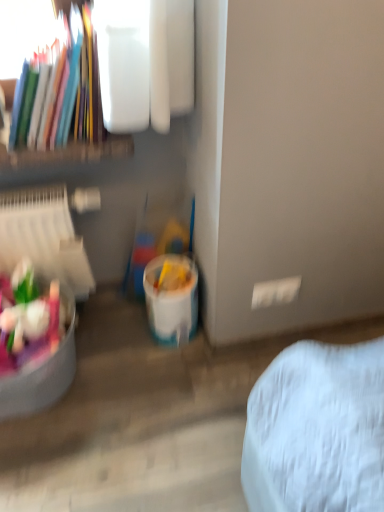
What is the approximate width of white plastic bucket at lower center?

white plastic bucket at lower center is 19.89 centimeters wide.

Image resolution: width=384 pixels, height=512 pixels. I want to click on matte plastic toys at lower left, so click(29, 319).

Does matte plastic books at upper left turn towards matte plastic toys at lower left?

No, matte plastic books at upper left is not aimed at matte plastic toys at lower left.

Which is correct: matte plastic books at upper left is inside matte plastic toys at lower left, or outside of it?

matte plastic books at upper left is outside matte plastic toys at lower left.

How distant is matte plastic books at upper left from matte plastic toys at lower left?

They are 51.07 centimeters apart.

Considering the sizes of matte plastic toys at lower left and white plastic bucket at lower center in the image, is matte plastic toys at lower left wider or thinner than white plastic bucket at lower center?

matte plastic toys at lower left is wider than white plastic bucket at lower center.

Does matte plastic toys at lower left contain white plastic bucket at lower center?

No, white plastic bucket at lower center is not surrounded by matte plastic toys at lower left.

Is matte plastic toys at lower left not close to white plastic bucket at lower center?

matte plastic toys at lower left is actually quite close to white plastic bucket at lower center.

Could you tell me if matte plastic toys at lower left is turned towards white plastic bucket at lower center?

No, matte plastic toys at lower left is not turned towards white plastic bucket at lower center.

Is matte plastic books at upper left facing away from white plastic bucket at lower center?

No, matte plastic books at upper left is not facing the opposite direction of white plastic bucket at lower center.

Considering the sizes of objects matte plastic books at upper left and white plastic bucket at lower center in the image provided, who is thinner, matte plastic books at upper left or white plastic bucket at lower center?

With smaller width is white plastic bucket at lower center.

Which object is closer to the camera taking this photo, matte plastic books at upper left or white plastic bucket at lower center?

matte plastic books at upper left is in front.

Between matte plastic books at upper left and white plastic bucket at lower center, which one has smaller size?

white plastic bucket at lower center is smaller.

Which of these two, white plastic bucket at lower center or matte plastic toys at lower left, is smaller?

white plastic bucket at lower center.

Considering their positions, is white plastic bucket at lower center located in front of or behind matte plastic toys at lower left?

Visually, white plastic bucket at lower center is located behind matte plastic toys at lower left.

Would you say white plastic bucket at lower center is outside matte plastic toys at lower left?

white plastic bucket at lower center is positioned outside matte plastic toys at lower left.

Between white plastic bucket at lower center and matte plastic books at upper left, which one has larger size?

matte plastic books at upper left.

Considering the points (186, 285) and (64, 139), which point is in front, point (186, 285) or point (64, 139)?

The point (64, 139) is in front.

Considering the positions of objects white plastic bucket at lower center and matte plastic books at upper left in the image provided, who is in front, white plastic bucket at lower center or matte plastic books at upper left?

Positioned in front is matte plastic books at upper left.

Where is `book above the white plastic bucket at lower center (from the image's perspective)`? book above the white plastic bucket at lower center (from the image's perspective) is located at coordinates (59, 88).

Which point is more forward, (x=44, y=350) or (x=24, y=122)?

The point (x=24, y=122) is more forward.

Is matte plastic toys at lower left next to matte plastic books at upper left and touching it?

There is a gap between matte plastic toys at lower left and matte plastic books at upper left.

In the image, is matte plastic toys at lower left positioned in front of or behind matte plastic books at upper left?

In the image, matte plastic toys at lower left appears behind matte plastic books at upper left.

You are a GUI agent. You are given a task and a screenshot of the screen. Output one action in this format:
    pyautogui.click(x=<x>, y=<y>)
    Task: Click on the food beneath the matte plastic books at upper left (from a real-world perspective)
    The image size is (384, 512).
    Given the screenshot: What is the action you would take?
    pyautogui.click(x=29, y=319)

Locate an element on the screen. Image resolution: width=384 pixels, height=512 pixels. food in front of the white plastic bucket at lower center is located at coordinates (29, 319).

Which object lies nearer to the anchor point white plastic bucket at lower center, matte plastic toys at lower left or matte plastic books at upper left?

Based on the image, matte plastic toys at lower left appears to be nearer to white plastic bucket at lower center.

From the image, which object appears to be nearer to matte plastic books at upper left, matte plastic toys at lower left or white plastic bucket at lower center?

Based on the image, matte plastic toys at lower left appears to be nearer to matte plastic books at upper left.

Estimate the real-world distances between objects in this image. Which object is closer to white plastic bucket at lower center, matte plastic books at upper left or matte plastic toys at lower left?

matte plastic toys at lower left lies closer to white plastic bucket at lower center than the other object.

Looking at the image, which one is located closer to matte plastic toys at lower left, white plastic bucket at lower center or matte plastic books at upper left?

white plastic bucket at lower center is closer to matte plastic toys at lower left.

Looking at the image, which one is located further to matte plastic books at upper left, white plastic bucket at lower center or matte plastic toys at lower left?

The object further to matte plastic books at upper left is white plastic bucket at lower center.

Which object lies nearer to the anchor point matte plastic toys at lower left, matte plastic books at upper left or white plastic bucket at lower center?

white plastic bucket at lower center lies closer to matte plastic toys at lower left than the other object.

The width and height of the screenshot is (384, 512). I want to click on bucket between matte plastic books at upper left and matte plastic toys at lower left vertically, so click(171, 298).